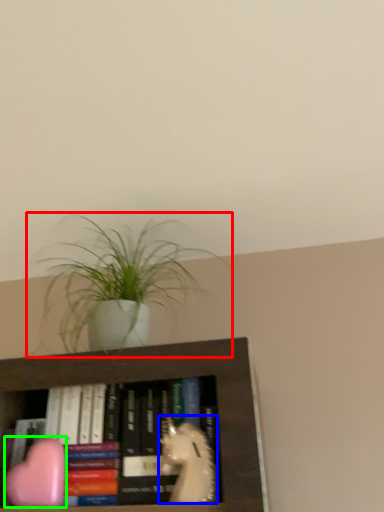
Question: Which object is positioned closest to houseplant (highlighted by a red box)? Select from animal (highlighted by a blue box) and animal (highlighted by a green box).

Choices:
 (A) animal
 (B) animal

Answer: (B)